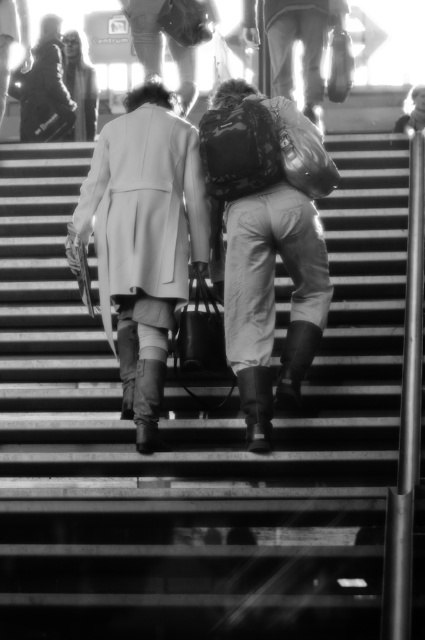
You are a photographer trying to capture a clear shot of both the camouflage backpack at center and the white matte coat at center. Since you want to focus on the smaller object first, which one should you adjust your camera settings for?

The camouflage backpack at center is smaller than the white matte coat at center, so you should adjust your camera settings for the camouflage backpack at center first.

You are a photographer trying to capture a clear shot of the white matte coat at center and the camouflage backpack at center. Since you are positioned at the bottom of the stairs, which object should you aim your camera at first to ensure you capture both in the frame?

The camouflage backpack at center is located below the white matte coat at center. Since you are at the bottom of the stairs, aim for the camouflage backpack at center first, then adjust upward to include the white matte coat at center in your frame.